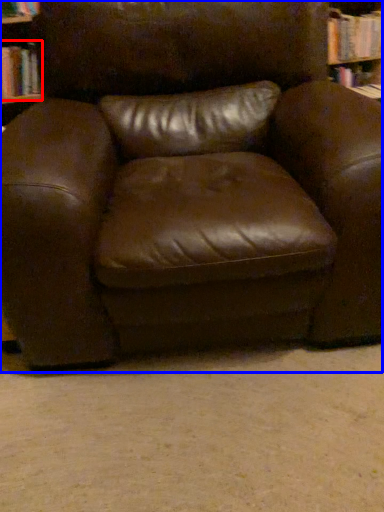
Question: Which object is further to the camera taking this photo, book (highlighted by a red box) or chair (highlighted by a blue box)?

Choices:
 (A) book
 (B) chair

Answer: (A)